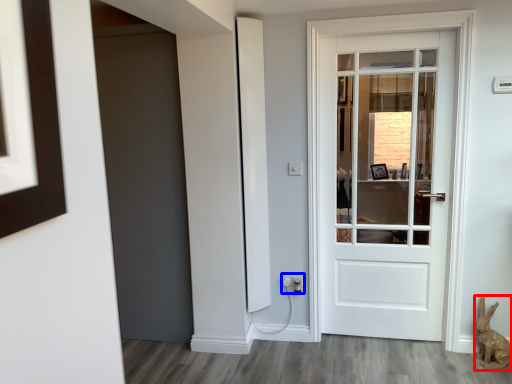
Question: Which point is closer to the camera, animal (highlighted by a red box) or electric outlet (highlighted by a blue box)?

Choices:
 (A) animal
 (B) electric outlet

Answer: (A)